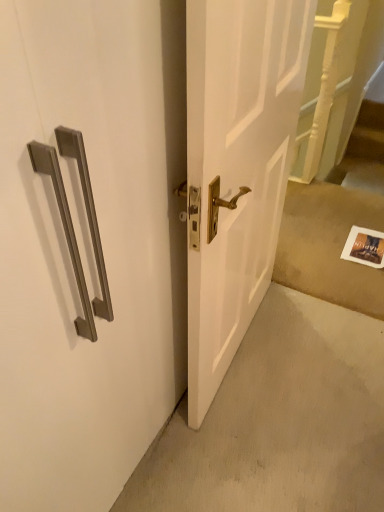
Question: Should I look upward or downward to see white paper at lower right?

Choices:
 (A) up
 (B) down

Answer: (A)

Question: Considering the relative sizes of wooden staircase at right and white paper at lower right in the image provided, is wooden staircase at right smaller than white paper at lower right?

Choices:
 (A) yes
 (B) no

Answer: (A)

Question: Can you confirm if wooden staircase at right is wider than white paper at lower right?

Choices:
 (A) no
 (B) yes

Answer: (A)

Question: Are wooden staircase at right and white paper at lower right making contact?

Choices:
 (A) yes
 (B) no

Answer: (B)

Question: Is wooden staircase at right looking in the opposite direction of white paper at lower right?

Choices:
 (A) yes
 (B) no

Answer: (B)

Question: Does wooden staircase at right contain white paper at lower right?

Choices:
 (A) no
 (B) yes

Answer: (A)

Question: Does wooden staircase at right have a lesser width compared to white paper at lower right?

Choices:
 (A) yes
 (B) no

Answer: (A)

Question: Is satin nickel handle at upper left positioned beyond the bounds of wooden staircase at right?

Choices:
 (A) no
 (B) yes

Answer: (B)

Question: Is satin nickel handle at upper left turned away from wooden staircase at right?

Choices:
 (A) no
 (B) yes

Answer: (A)

Question: Is satin nickel handle at upper left positioned behind wooden staircase at right?

Choices:
 (A) no
 (B) yes

Answer: (A)

Question: Is satin nickel handle at upper left at the right side of wooden staircase at right?

Choices:
 (A) yes
 (B) no

Answer: (B)

Question: Does satin nickel handle at upper left have a larger size compared to wooden staircase at right?

Choices:
 (A) yes
 (B) no

Answer: (A)

Question: Is the depth of satin nickel handle at upper left less than that of wooden staircase at right?

Choices:
 (A) yes
 (B) no

Answer: (A)

Question: Is wooden staircase at right at the left side of satin nickel handle at upper left?

Choices:
 (A) yes
 (B) no

Answer: (B)